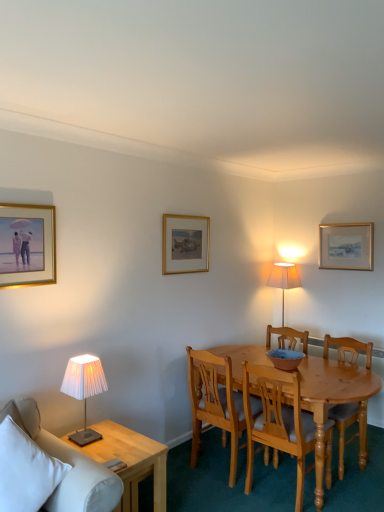
Locate an element on the screen. free space above light wood side table at lower left (from a real-world perspective) is located at coordinates (117, 440).